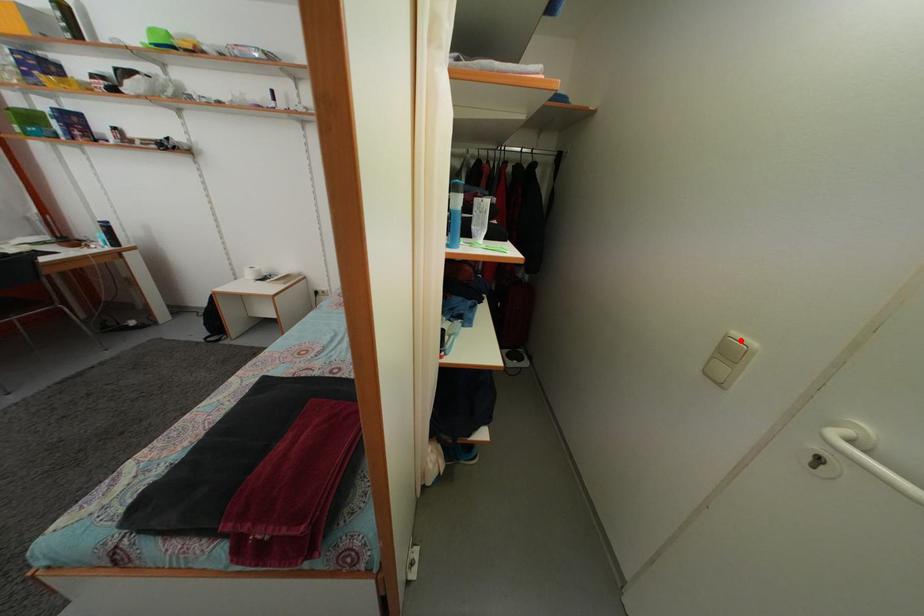
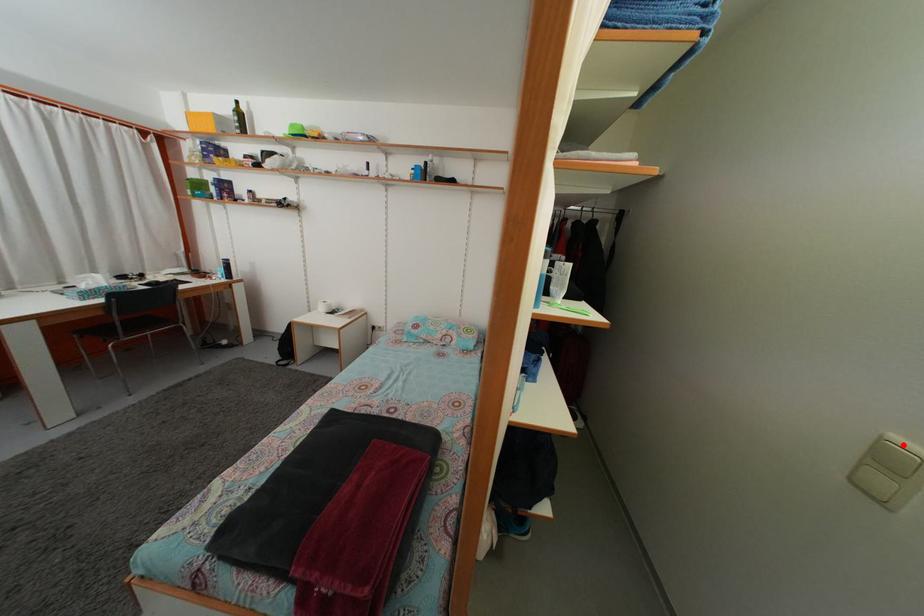
I am providing you with two images of the same scene from different viewpoints. A red point is marked on the first image and another point is marked on the second image. Does the point marked in image1 correspond to the same location as the one in image2?

Yes